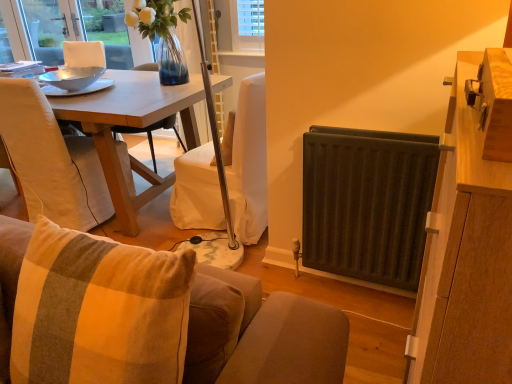
In order to face beige fabric chair at left, should I rotate leftwards or rightwards?

You should look left and rotate roughly 25.311 degrees.

The height and width of the screenshot is (384, 512). What do you see at coordinates (132, 126) in the screenshot?
I see `wooden table at center` at bounding box center [132, 126].

Locate an element on the screen. The height and width of the screenshot is (384, 512). wooden cabinet at right is located at coordinates (469, 235).

Locate an element on the screen. Image resolution: width=512 pixels, height=384 pixels. beige fabric chair at left is located at coordinates (51, 161).

Can you confirm if plush fabric couch at lower center is smaller than beige fabric chair at left?

Actually, plush fabric couch at lower center might be larger than beige fabric chair at left.

Which object is wider, plush fabric couch at lower center or beige fabric chair at left?

beige fabric chair at left.

Between plush fabric couch at lower center and beige fabric chair at left, which one appears on the left side from the viewer's perspective?

From the viewer's perspective, beige fabric chair at left appears more on the left side.

Is plush fabric couch at lower center not within beige fabric chair at left?

That's correct, plush fabric couch at lower center is outside of beige fabric chair at left.

Is dark gray metal radiator at right in contact with wooden cabinet at right?

dark gray metal radiator at right is not next to wooden cabinet at right, and they're not touching.

Which is behind, dark gray metal radiator at right or wooden cabinet at right?

dark gray metal radiator at right is behind.

Which object is thinner, dark gray metal radiator at right or wooden cabinet at right?

dark gray metal radiator at right.

What's the angular difference between dark gray metal radiator at right and wooden cabinet at right's facing directions?

90.3 degrees.

Is wooden table at center thinner than plush fabric couch at lower center?

No.

Is wooden table at center not near plush fabric couch at lower center?

Yes, wooden table at center and plush fabric couch at lower center are located far from each other.

From a real-world perspective, between wooden table at center and plush fabric couch at lower center, who is vertically higher?

In real-world perspective, plush fabric couch at lower center is above.

How different are the orientations of wooden table at center and plush fabric couch at lower center in degrees?

There is a 2.75-degree angle between the facing directions of wooden table at center and plush fabric couch at lower center.

In the image, is wooden cabinet at right positioned in front of or behind plush fabric couch at lower center?

In the image, wooden cabinet at right appears in front of plush fabric couch at lower center.

Consider the image. From the image's perspective, between wooden cabinet at right and plush fabric couch at lower center, who is located below?

plush fabric couch at lower center appears lower in the image.

Does wooden cabinet at right have a lesser width compared to plush fabric couch at lower center?

Indeed, wooden cabinet at right has a lesser width compared to plush fabric couch at lower center.

Looking at this image, is wooden cabinet at right at the right side of plush fabric couch at lower center?

Yes.

Do you think beige fabric chair at left is within plush fabric couch at lower center, or outside of it?

beige fabric chair at left exists outside the volume of plush fabric couch at lower center.

Relative to plush fabric couch at lower center, is beige fabric chair at left in front or behind?

Clearly, beige fabric chair at left is behind plush fabric couch at lower center.

Where is `studio couch on the right of the beige fabric chair at left`? Image resolution: width=512 pixels, height=384 pixels. studio couch on the right of the beige fabric chair at left is located at coordinates (260, 334).

Can you confirm if beige fabric chair at left is taller than plush fabric couch at lower center?

Yes.

From the picture: From a real-world perspective, who is located higher, wooden table at center or dark gray metal radiator at right?

dark gray metal radiator at right is physically above.

Measure the distance between wooden table at center and dark gray metal radiator at right.

wooden table at center and dark gray metal radiator at right are 1.18 meters apart.

Looking at this image, from the image's perspective, is wooden table at center located above dark gray metal radiator at right?

Yes, from the image's perspective, wooden table at center is on top of dark gray metal radiator at right.

In terms of width, does wooden table at center look wider or thinner when compared to dark gray metal radiator at right?

Considering their sizes, wooden table at center looks broader than dark gray metal radiator at right.

Consider the image. In terms of height, does plush fabric couch at lower center look taller or shorter compared to wooden cabinet at right?

plush fabric couch at lower center is shorter than wooden cabinet at right.

From a real-world perspective, is plush fabric couch at lower center physically located above or below wooden cabinet at right?

plush fabric couch at lower center is below wooden cabinet at right.

From the image's perspective, does plush fabric couch at lower center appear higher than wooden cabinet at right?

No.

How different are the orientations of plush fabric couch at lower center and wooden cabinet at right in degrees?

The angular difference between plush fabric couch at lower center and wooden cabinet at right is 89.8 degrees.

Locate an element on the screen. This screenshot has width=512, height=384. studio couch that is in front of the beige fabric chair at left is located at coordinates (260, 334).

Image resolution: width=512 pixels, height=384 pixels. What are the coordinates of `cabinetry located below the dark gray metal radiator at right (from the image's perspective)` in the screenshot? It's located at (469, 235).

Looking at the image, which one is located further to plush fabric couch at lower center, dark gray metal radiator at right or wooden cabinet at right?

dark gray metal radiator at right lies further to plush fabric couch at lower center than the other object.

Which object lies nearer to the anchor point plush fabric couch at lower center, wooden cabinet at right or beige fabric chair at left?

The object closer to plush fabric couch at lower center is wooden cabinet at right.

Based on the photo, looking at the image, which one is located closer to plush fabric couch at lower center, wooden cabinet at right or dark gray metal radiator at right?

Among the two, wooden cabinet at right is located nearer to plush fabric couch at lower center.

Which object lies nearer to the anchor point dark gray metal radiator at right, wooden table at center or wooden cabinet at right?

wooden cabinet at right is closer to dark gray metal radiator at right.

Estimate the real-world distances between objects in this image. Which object is closer to wooden cabinet at right, plush fabric couch at lower center or beige fabric chair at left?

The object closer to wooden cabinet at right is plush fabric couch at lower center.

From the image, which object appears to be farther from wooden table at center, plush fabric couch at lower center or wooden cabinet at right?

wooden cabinet at right is further to wooden table at center.

Based on the photo, from the image, which object appears to be nearer to dark gray metal radiator at right, wooden cabinet at right or wooden table at center?

Among the two, wooden cabinet at right is located nearer to dark gray metal radiator at right.

Which object lies further to the anchor point beige fabric chair at left, plush fabric couch at lower center or dark gray metal radiator at right?

The object further to beige fabric chair at left is plush fabric couch at lower center.

Locate an element on the screen. The width and height of the screenshot is (512, 384). table positioned between plush fabric couch at lower center and beige fabric chair at left from near to far is located at coordinates (132, 126).

Image resolution: width=512 pixels, height=384 pixels. I want to click on chair between wooden table at center and wooden cabinet at right in the horizontal direction, so click(51, 161).

Locate an element on the screen. chair located between wooden table at center and dark gray metal radiator at right in the left-right direction is located at coordinates (51, 161).

The image size is (512, 384). I want to click on studio couch between wooden cabinet at right and dark gray metal radiator at right from front to back, so click(x=260, y=334).